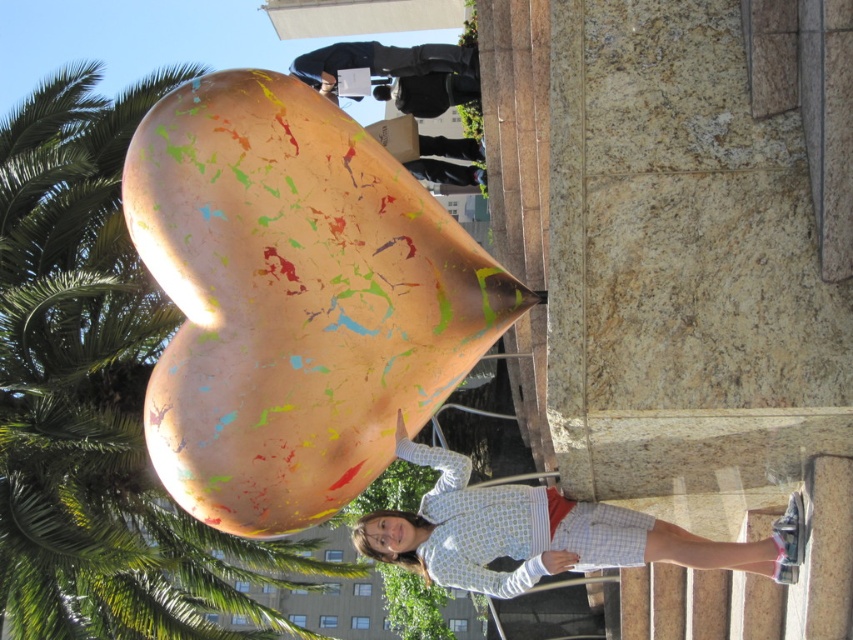
Question: Which point appears farthest from the camera in this image?

Choices:
 (A) (48, 456)
 (B) (166, 99)

Answer: (A)

Question: Can you confirm if green leafy palm tree at upper left is bigger than light blue striped shirt at center?

Choices:
 (A) yes
 (B) no

Answer: (A)

Question: Does green leafy palm tree at upper left lie in front of light blue striped shirt at center?

Choices:
 (A) no
 (B) yes

Answer: (A)

Question: Which of the following is the closest to the observer?

Choices:
 (A) green leafy palm tree at upper left
 (B) light blue striped shirt at center

Answer: (B)

Question: Does multicolored painted heart at center have a smaller size compared to light blue striped shirt at center?

Choices:
 (A) yes
 (B) no

Answer: (B)

Question: Considering the real-world distances, which object is farthest from the light blue striped shirt at center?

Choices:
 (A) multicolored painted heart at center
 (B) green leafy palm tree at upper left

Answer: (B)